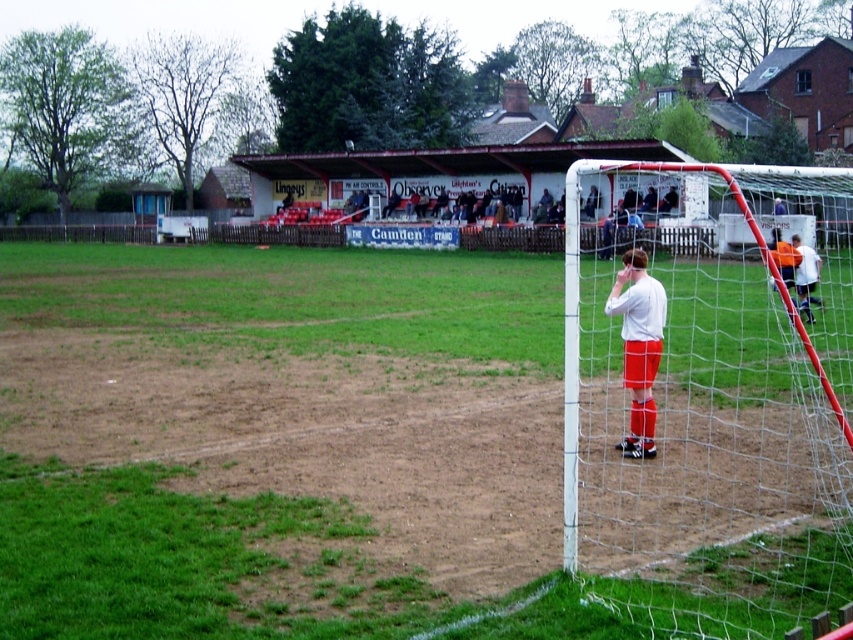
You are a soccer player standing at the center of the field. You want to kick the ball to the green grass at lower left. Which direction should you kick the ball?

The green grass at lower left is located at point (231, 420), so you should kick the ball towards the lower left direction.

In the scene shown: You are a soccer player standing on the field and want to kick a ball to the white mesh net at right. If you can kick the ball up to 5 meters, will you be able to reach it?

The distance between you and the white mesh net at right is 4.59 meters, which is within your kicking range of 5 meters. Therefore, you can reach it.